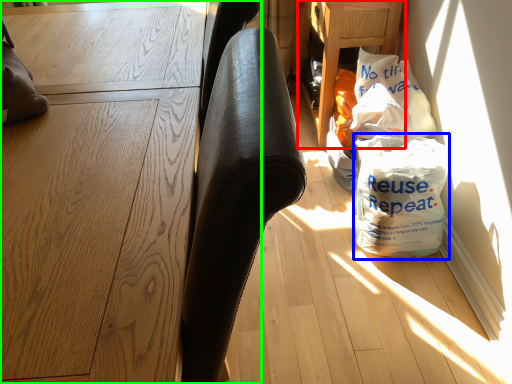
Question: Which object is positioned closest to table (highlighted by a red box)? Select from grocery bag (highlighted by a blue box) and furniture (highlighted by a green box).

Choices:
 (A) grocery bag
 (B) furniture

Answer: (A)